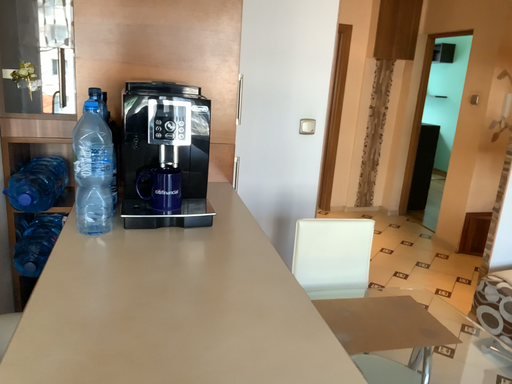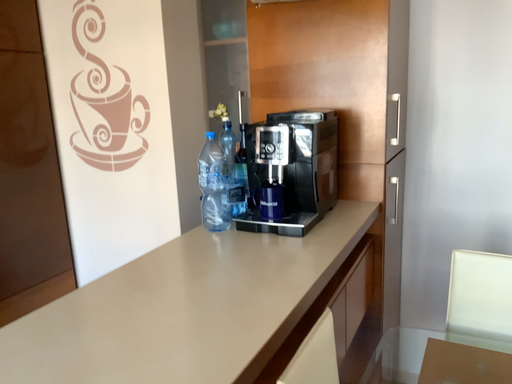
Question: Which way did the camera rotate in the video?

Choices:
 (A) rotated right
 (B) rotated left

Answer: (B)